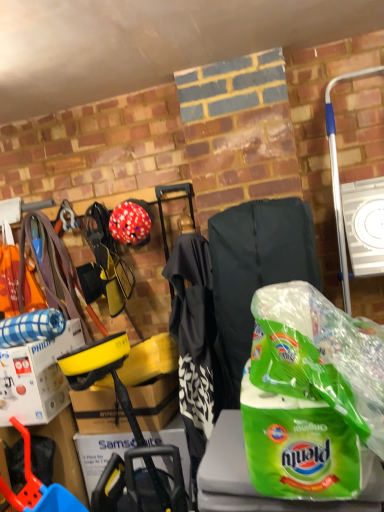
This screenshot has height=512, width=384. In order to click on green plastic bag at center in this screenshot , I will do `click(310, 394)`.

What is the approximate height of white cardboard box at left?

white cardboard box at left is 32.60 centimeters in height.

The height and width of the screenshot is (512, 384). Identify the location of matte red helmet at center. (131, 222).

You are a GUI agent. You are given a task and a screenshot of the screen. Output one action in this format:
    pyautogui.click(x=<x>, y=<y>)
    Task: Click on the plastic bag in front of the matte red helmet at center
    The height and width of the screenshot is (512, 384).
    Given the screenshot: What is the action you would take?
    pyautogui.click(x=310, y=394)

Who is bigger, green plastic bag at center or matte red helmet at center?

green plastic bag at center is bigger.

From the image's perspective, which one is positioned higher, green plastic bag at center or matte red helmet at center?

matte red helmet at center is shown above in the image.

Looking at their sizes, would you say green plastic bag at center is wider or thinner than matte red helmet at center?

Clearly, green plastic bag at center has more width compared to matte red helmet at center.

Is white cardboard box at left thinner than matte red helmet at center?

No, white cardboard box at left is not thinner than matte red helmet at center.

Looking at this image, which object is closer to the camera taking this photo, white cardboard box at left or matte red helmet at center?

white cardboard box at left.

Is white cardboard box at left oriented away from matte red helmet at center?

No, matte red helmet at center is not at the back of white cardboard box at left.

Which of these two, white cardboard box at left or green plastic bag at center, stands taller?

green plastic bag at center is taller.

Considering the relative positions of white cardboard box at left and green plastic bag at center in the image provided, is white cardboard box at left to the left of green plastic bag at center from the viewer's perspective?

Indeed, white cardboard box at left is positioned on the left side of green plastic bag at center.

Considering the positions of point (27, 378) and point (257, 428), is point (27, 378) closer or farther from the camera than point (257, 428)?

Clearly, point (27, 378) is more distant from the camera than point (257, 428).

Between white cardboard box at left and green plastic bag at center, which one has larger size?

Bigger between the two is green plastic bag at center.

Where is `plastic bag on the right of matte red helmet at center`? plastic bag on the right of matte red helmet at center is located at coordinates (310, 394).

Consider the image. From the image's perspective, which is above, matte red helmet at center or green plastic bag at center?

matte red helmet at center.

Is point (135, 221) farther from camera compared to point (272, 481)?

That is True.

Which of these two, matte red helmet at center or green plastic bag at center, is wider?

With larger width is green plastic bag at center.

Which is in front, point (305, 289) or point (20, 397)?

Positioned in front is point (305, 289).

Considering the sizes of objects green plastic bag at center and white cardboard box at left in the image provided, who is thinner, green plastic bag at center or white cardboard box at left?

Thinner between the two is white cardboard box at left.

Between matte red helmet at center and white cardboard box at left, which one has smaller size?

matte red helmet at center.

Does matte red helmet at center turn towards white cardboard box at left?

No, matte red helmet at center is not turned towards white cardboard box at left.

From a real-world perspective, is matte red helmet at center positioned over white cardboard box at left based on gravity?

Yes, from a real-world perspective, matte red helmet at center is above white cardboard box at left.

Between matte red helmet at center and white cardboard box at left, which one has larger width?

white cardboard box at left is wider.

The image size is (384, 512). I want to click on helmet located on the left of green plastic bag at center, so click(131, 222).

At what (x,y) coordinates should I click in order to perform the action: click on helmet that appears behind the white cardboard box at left. Please return your answer as a coordinate pair (x, y). The width and height of the screenshot is (384, 512). Looking at the image, I should click on (131, 222).

Looking at the image, which one is located further to white cardboard box at left, green plastic bag at center or matte red helmet at center?

green plastic bag at center lies further to white cardboard box at left than the other object.

Which object lies nearer to the anchor point matte red helmet at center, white cardboard box at left or green plastic bag at center?

Based on the image, white cardboard box at left appears to be nearer to matte red helmet at center.

When comparing their distances from green plastic bag at center, does matte red helmet at center or white cardboard box at left seem further?

white cardboard box at left is further to green plastic bag at center.

Looking at the image, which one is located closer to matte red helmet at center, green plastic bag at center or white cardboard box at left?

The object closer to matte red helmet at center is white cardboard box at left.

Considering their positions, is matte red helmet at center positioned further to white cardboard box at left than green plastic bag at center?

Among the two, green plastic bag at center is located further to white cardboard box at left.

Looking at the image, which one is located closer to green plastic bag at center, white cardboard box at left or matte red helmet at center?

Based on the image, matte red helmet at center appears to be nearer to green plastic bag at center.

The height and width of the screenshot is (512, 384). I want to click on helmet between white cardboard box at left and green plastic bag at center from left to right, so click(131, 222).